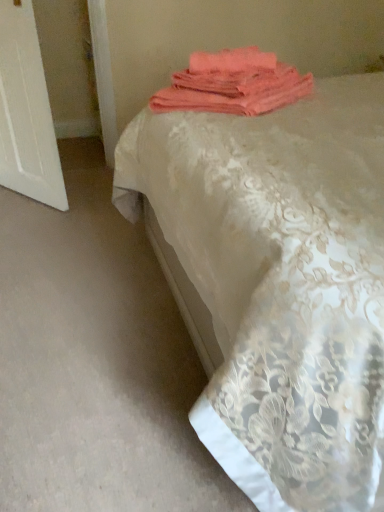
Question: Can you confirm if coral fabric towel at upper center is thinner than silky lace bedspread at center?

Choices:
 (A) no
 (B) yes

Answer: (B)

Question: From the image's perspective, is coral fabric towel at upper center located beneath silky lace bedspread at center?

Choices:
 (A) yes
 (B) no

Answer: (B)

Question: Considering the relative sizes of coral fabric towel at upper center and silky lace bedspread at center in the image provided, is coral fabric towel at upper center taller than silky lace bedspread at center?

Choices:
 (A) no
 (B) yes

Answer: (A)

Question: Are coral fabric towel at upper center and silky lace bedspread at center making contact?

Choices:
 (A) no
 (B) yes

Answer: (A)

Question: Is silky lace bedspread at center inside coral fabric towel at upper center?

Choices:
 (A) no
 (B) yes

Answer: (A)

Question: In the image, is coral fabric towel at upper center positioned in front of or behind silky lace bedspread at center?

Choices:
 (A) behind
 (B) front

Answer: (A)

Question: From a real-world perspective, is coral fabric towel at upper center positioned above or below silky lace bedspread at center?

Choices:
 (A) above
 (B) below

Answer: (A)

Question: Looking at their shapes, would you say coral fabric towel at upper center is wider or thinner than silky lace bedspread at center?

Choices:
 (A) wide
 (B) thin

Answer: (B)

Question: Looking at the image, does coral fabric towel at upper center seem bigger or smaller compared to silky lace bedspread at center?

Choices:
 (A) big
 (B) small

Answer: (B)

Question: Do you think coral fabric towel at upper center is within white wood door at left, or outside of it?

Choices:
 (A) outside
 (B) inside

Answer: (A)

Question: Considering their positions, is coral fabric towel at upper center located in front of or behind white wood door at left?

Choices:
 (A) front
 (B) behind

Answer: (A)

Question: In terms of width, does coral fabric towel at upper center look wider or thinner when compared to white wood door at left?

Choices:
 (A) thin
 (B) wide

Answer: (B)

Question: Considering the relative positions of coral fabric towel at upper center and white wood door at left in the image provided, is coral fabric towel at upper center to the left or to the right of white wood door at left?

Choices:
 (A) left
 (B) right

Answer: (B)

Question: Considering their positions, is white wood door at left located in front of or behind coral fabric towel at upper center?

Choices:
 (A) front
 (B) behind

Answer: (B)

Question: In terms of size, does white wood door at left appear bigger or smaller than coral fabric towel at upper center?

Choices:
 (A) big
 (B) small

Answer: (A)